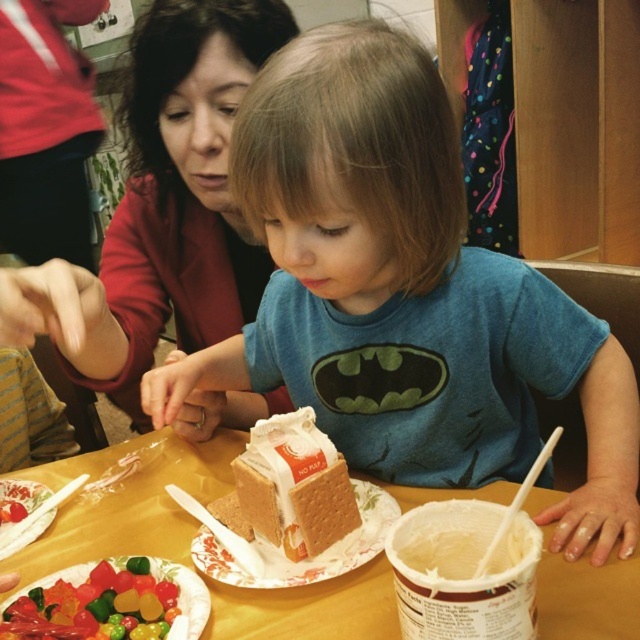
Question: Among these objects, which one is farthest from the camera?

Choices:
 (A) matte red sweater at upper left
 (B) caramel-golden cake at center

Answer: (B)

Question: Which object is closer to the camera taking this photo?

Choices:
 (A) white paper plate at lower left
 (B) caramel-golden cake at center
 (C) blue cotton shirt at center
 (D) matte red sweater at upper left

Answer: (D)

Question: Can you confirm if blue cotton shirt at center is positioned to the left of smooth cardboard table at center?

Choices:
 (A) no
 (B) yes

Answer: (A)

Question: Considering the real-world distances, which object is closest to the matte red sweater at upper left?

Choices:
 (A) white paper plate at lower left
 (B) white plastic straw at lower center
 (C) gummy candies at center
 (D) caramel-golden cake at center

Answer: (A)

Question: Can you confirm if smooth cardboard table at center is bigger than gummy candies at center?

Choices:
 (A) no
 (B) yes

Answer: (B)

Question: Does blue cotton shirt at center appear over caramel-golden cake at center?

Choices:
 (A) no
 (B) yes

Answer: (B)